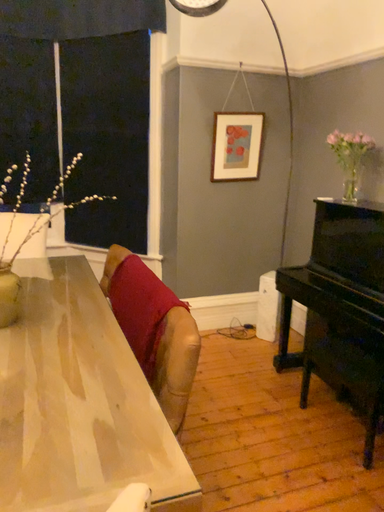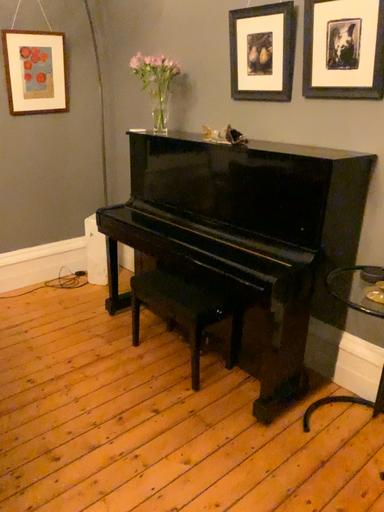
Question: Which way did the camera rotate in the video?

Choices:
 (A) rotated left
 (B) rotated right

Answer: (B)